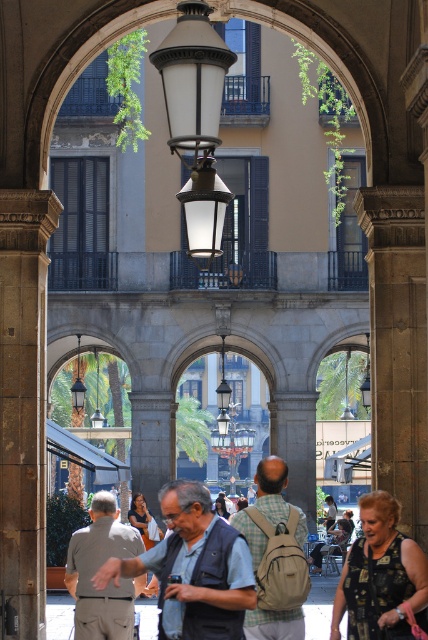
Can you confirm if gray fabric vest at center is taller than printed fabric dress at center?

Yes.

Is gray fabric vest at center wider than printed fabric dress at center?

Correct, the width of gray fabric vest at center exceeds that of printed fabric dress at center.

What do you see at coordinates (195, 566) in the screenshot?
I see `gray fabric vest at center` at bounding box center [195, 566].

Find the location of a particular element. gray fabric vest at center is located at coordinates (195, 566).

Who is taller, matte white glass at center or metallic glass lamp post at center?

With more height is metallic glass lamp post at center.

Based on the photo, measure the distance between point (172, 90) and camera.

The distance of point (172, 90) from camera is 95.16 feet.

Find the location of a particular element. This screenshot has width=428, height=640. matte white glass at center is located at coordinates (196, 120).

Between matte black lamp at center and light brown backpack at center, which one has less height?

Standing shorter between the two is light brown backpack at center.

Is matte black lamp at center to the right of light brown backpack at center from the viewer's perspective?

No, matte black lamp at center is not to the right of light brown backpack at center.

Between point (74, 387) and point (219, 515), which one is positioned behind?

The point (219, 515) is behind.

The height and width of the screenshot is (640, 428). I want to click on matte black lamp at center, so click(x=77, y=385).